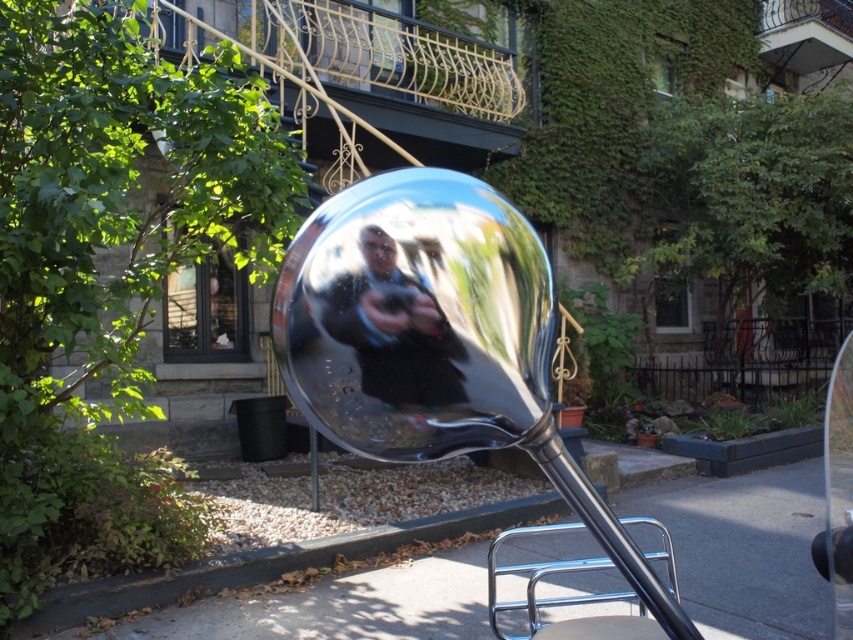
Question: Which point appears closest to the camera in this image?

Choices:
 (A) (624, 500)
 (B) (432, 353)

Answer: (B)

Question: Does smooth concrete pavement at lower center have a smaller size compared to shiny metallic sphere at center?

Choices:
 (A) no
 (B) yes

Answer: (A)

Question: Can you confirm if chrome metallic rearview mirror at center is smaller than smooth concrete pavement at lower center?

Choices:
 (A) no
 (B) yes

Answer: (A)

Question: Which point is closer to the camera?

Choices:
 (A) shiny metallic sphere at center
 (B) chrome metallic rearview mirror at center

Answer: (B)

Question: Based on their relative distances, which object is farther from the shiny metallic sphere at center?

Choices:
 (A) smooth concrete pavement at lower center
 (B) chrome metallic rearview mirror at center

Answer: (A)

Question: Is smooth concrete pavement at lower center below shiny metallic sphere at center?

Choices:
 (A) no
 (B) yes

Answer: (B)